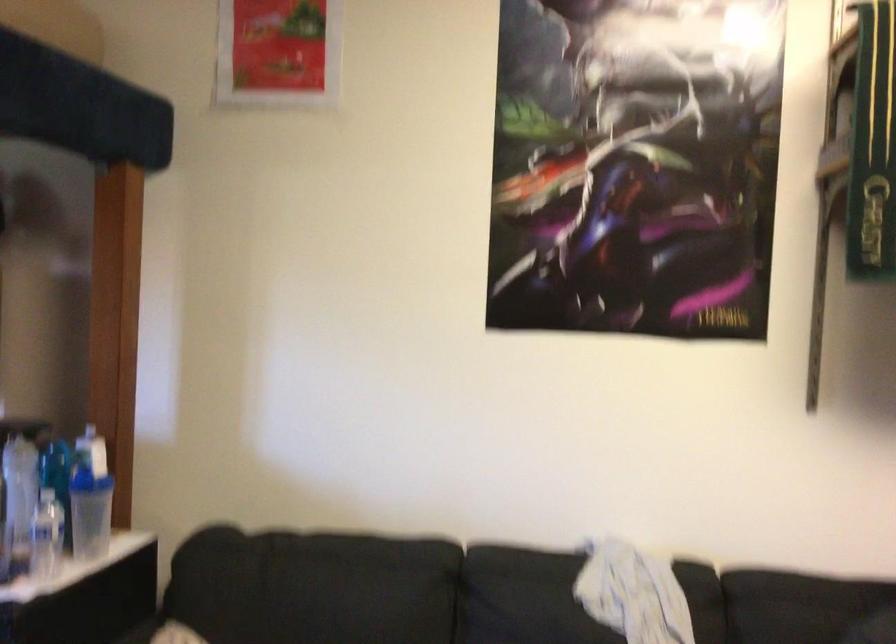
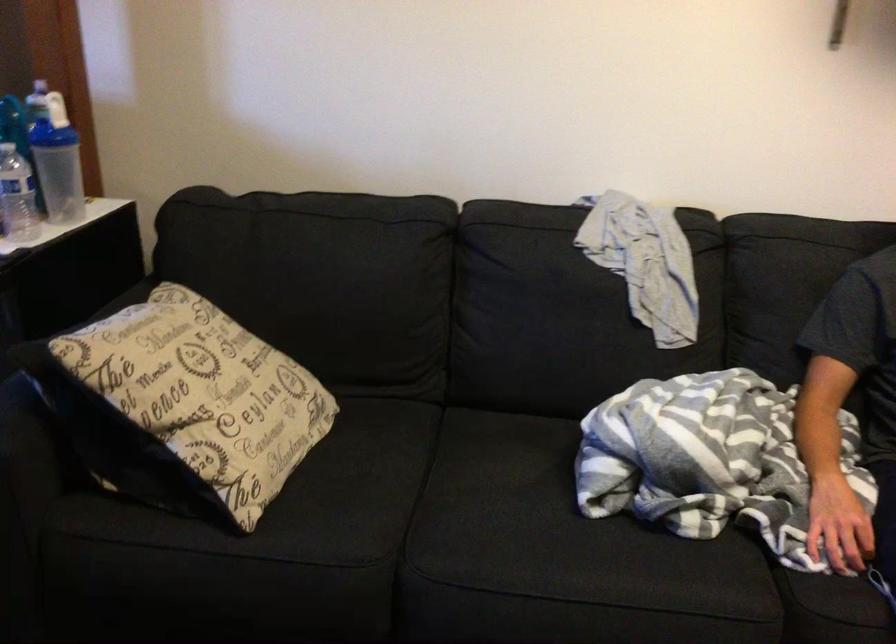
In the second image, find the point that corresponds to point (93, 427) in the first image.

(40, 80)